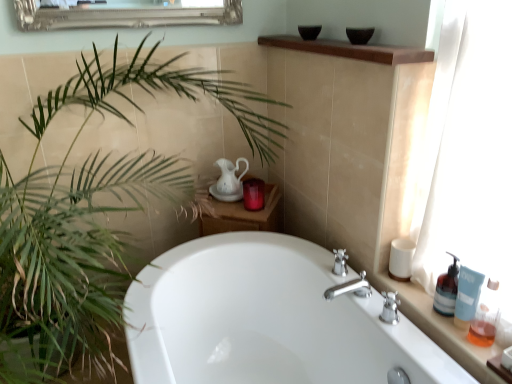
The image size is (512, 384). Find the location of `empty space that is ontop of translucent plastic bottles at right, acting as the second counter top starting from the top`. empty space that is ontop of translucent plastic bottles at right, acting as the second counter top starting from the top is located at coordinates (443, 316).